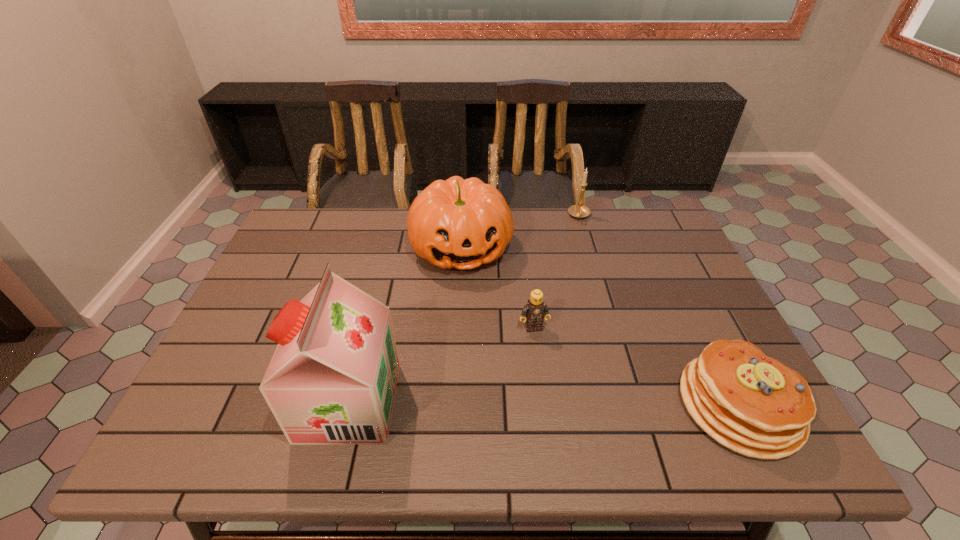
I want to click on free space located on the carved face of the pumpkin, so click(478, 311).

Locate an element on the screen. This screenshot has width=960, height=540. free space located on the carved face of the pumpkin is located at coordinates (492, 362).

I want to click on vacant space located 0.090m on the carved face of the pumpkin, so click(x=476, y=303).

You are a GUI agent. You are given a task and a screenshot of the screen. Output one action in this format:
    pyautogui.click(x=<x>, y=<y>)
    Task: Click on the vacant space situated 0.050m in front of the third farthest object
    This screenshot has width=960, height=540.
    Given the screenshot: What is the action you would take?
    pyautogui.click(x=540, y=348)

Image resolution: width=960 pixels, height=540 pixels. What are the coordinates of `free region located 0.060m in front of the third farthest object` in the screenshot? It's located at (541, 352).

This screenshot has width=960, height=540. I want to click on vacant space located in front of the third farthest object, so click(x=540, y=348).

Identify the location of free spot located 0.080m on the handle side of the third shortest object. (581, 239).

The image size is (960, 540). I want to click on vacant region located on the handle side of the third shortest object, so click(581, 241).

Identify the location of vacant position located 0.220m on the handle side of the third shortest object. (582, 267).

Identify the location of pumpkin that is at the far edge. (456, 223).